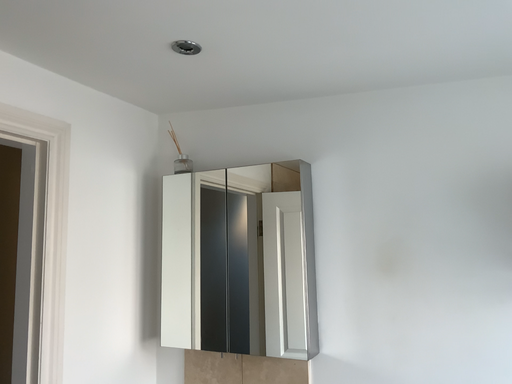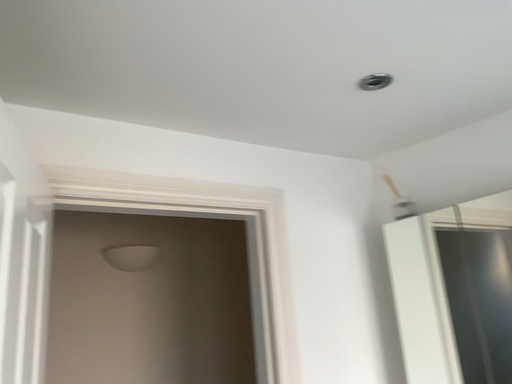
Question: Which way did the camera rotate in the video?

Choices:
 (A) rotated right
 (B) rotated left

Answer: (B)